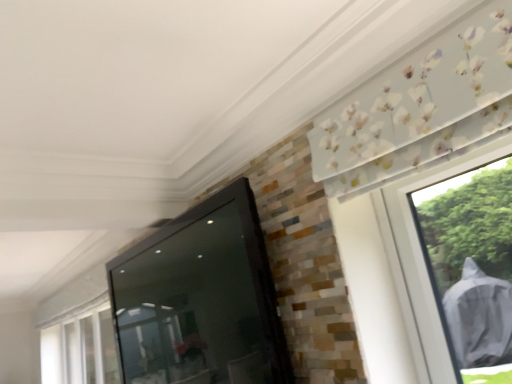
Question: From the image's perspective, is transparent plastic window at lower left under black glossy screen door at center?

Choices:
 (A) yes
 (B) no

Answer: (A)

Question: From the image's perspective, is transparent plastic window at lower left on top of black glossy screen door at center?

Choices:
 (A) yes
 (B) no

Answer: (B)

Question: Does transparent plastic window at lower left touch black glossy screen door at center?

Choices:
 (A) yes
 (B) no

Answer: (B)

Question: Is transparent plastic window at lower left positioned behind black glossy screen door at center?

Choices:
 (A) yes
 (B) no

Answer: (A)

Question: Is transparent plastic window at lower left smaller than black glossy screen door at center?

Choices:
 (A) yes
 (B) no

Answer: (A)

Question: Does transparent plastic window at lower left appear on the right side of black glossy screen door at center?

Choices:
 (A) yes
 (B) no

Answer: (B)

Question: From the image's perspective, is black glossy screen door at center beneath transparent plastic window at lower left?

Choices:
 (A) no
 (B) yes

Answer: (A)

Question: Can you confirm if black glossy screen door at center is shorter than transparent plastic window at lower left?

Choices:
 (A) no
 (B) yes

Answer: (A)

Question: Does black glossy screen door at center have a smaller size compared to transparent plastic window at lower left?

Choices:
 (A) yes
 (B) no

Answer: (B)

Question: From the image's perspective, does black glossy screen door at center appear higher than transparent plastic window at lower left?

Choices:
 (A) yes
 (B) no

Answer: (A)

Question: Is black glossy screen door at center positioned with its back to transparent plastic window at lower left?

Choices:
 (A) no
 (B) yes

Answer: (A)

Question: Does black glossy screen door at center have a greater height compared to transparent plastic window at lower left?

Choices:
 (A) yes
 (B) no

Answer: (A)

Question: From their relative heights in the image, would you say black glossy screen door at center is taller or shorter than transparent plastic window at lower left?

Choices:
 (A) short
 (B) tall

Answer: (B)